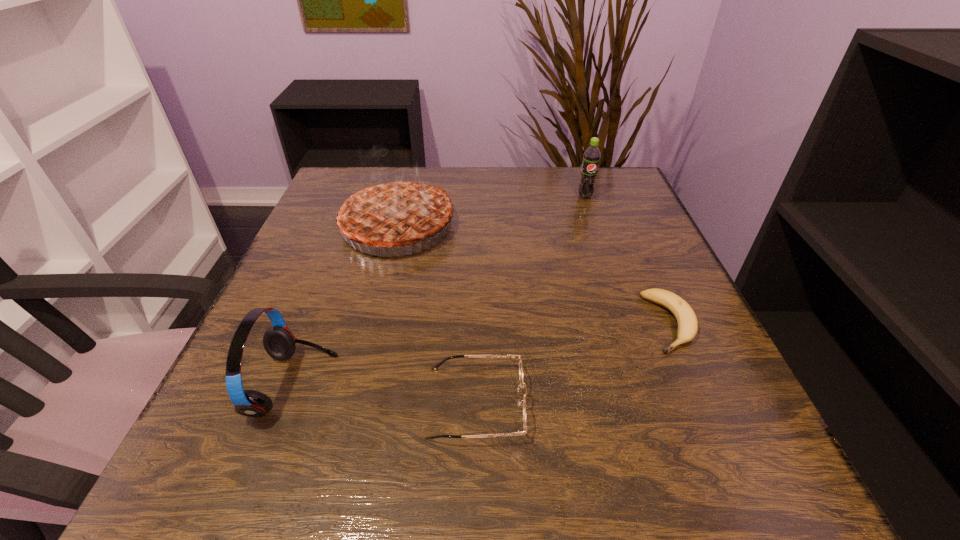
This screenshot has height=540, width=960. I want to click on vacant point located between the tallest object and the rightmost object, so coord(534,275).

This screenshot has width=960, height=540. I want to click on free spot between the tallest object and the third shortest object, so click(x=346, y=306).

Where is `free spot between the pie and the rightmost object`? free spot between the pie and the rightmost object is located at coordinates (534, 275).

Locate an element on the screen. This screenshot has width=960, height=540. empty location between the soda and the tallest object is located at coordinates (492, 211).

Where is `free point between the third tallest object and the tallest object`? free point between the third tallest object and the tallest object is located at coordinates (346, 306).

Where is `vacant point located between the tallest object and the fourth object from left to right`? This screenshot has width=960, height=540. vacant point located between the tallest object and the fourth object from left to right is located at coordinates (492, 211).

At what (x,y) coordinates should I click in order to perform the action: click on free space that is in between the pie and the second shortest object. Please return your answer as a coordinate pair (x, y). Looking at the image, I should click on (437, 314).

Find the location of a particular element. This screenshot has width=960, height=540. the third closest object to the pie is located at coordinates (591, 158).

Identify the location of object that stands as the fourth closest to the third tallest object. The width and height of the screenshot is (960, 540). (591, 158).

Identify the location of free location that satisfies the following two spatial constraints: 1. on the front label of the banana; 2. on the right side of the soda. The image size is (960, 540). (629, 323).